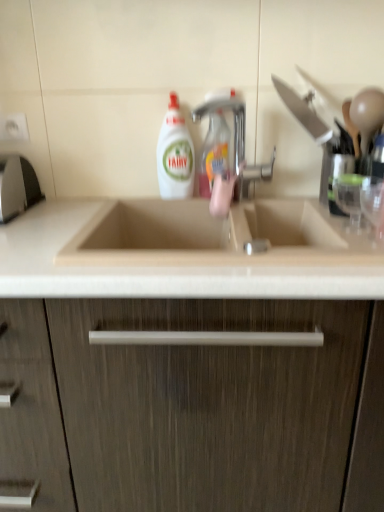
Question: Is translucent plastic spray bottle at center, which is counted as the second cleaning product, starting from the left, facing away from white glossy liquid at center, the 1th cleaning product positioned from the left?

Choices:
 (A) yes
 (B) no

Answer: (B)

Question: Can you confirm if translucent plastic spray bottle at center, which is counted as the second cleaning product, starting from the left, is taller than white glossy liquid at center, the second cleaning product in the right-to-left sequence?

Choices:
 (A) no
 (B) yes

Answer: (A)

Question: Is translucent plastic spray bottle at center, the first cleaning product positioned from the right, facing towards white glossy liquid at center, the second cleaning product in the right-to-left sequence?

Choices:
 (A) yes
 (B) no

Answer: (B)

Question: Is translucent plastic spray bottle at center, the first cleaning product positioned from the right, smaller than white glossy liquid at center, the 1th cleaning product positioned from the left?

Choices:
 (A) no
 (B) yes

Answer: (B)

Question: Can you confirm if translucent plastic spray bottle at center, the first cleaning product positioned from the right, is bigger than white glossy liquid at center, the second cleaning product in the right-to-left sequence?

Choices:
 (A) yes
 (B) no

Answer: (B)

Question: Is beige marble countertop at center bigger or smaller than white glossy liquid at center, the second cleaning product in the right-to-left sequence?

Choices:
 (A) small
 (B) big

Answer: (B)

Question: Would you say beige marble countertop at center is inside or outside white glossy liquid at center, the 1th cleaning product positioned from the left?

Choices:
 (A) outside
 (B) inside

Answer: (A)

Question: Visually, is beige marble countertop at center positioned to the left or to the right of white glossy liquid at center, the second cleaning product in the right-to-left sequence?

Choices:
 (A) right
 (B) left

Answer: (A)

Question: Considering the positions of point (296, 231) and point (180, 126), is point (296, 231) closer or farther from the camera than point (180, 126)?

Choices:
 (A) closer
 (B) farther

Answer: (B)

Question: Would you say translucent plastic spray bottle at center, the first cleaning product positioned from the right, is inside or outside white glossy liquid at center, the second cleaning product in the right-to-left sequence?

Choices:
 (A) outside
 (B) inside

Answer: (A)

Question: Considering their positions, is translucent plastic spray bottle at center, the first cleaning product positioned from the right, located in front of or behind white glossy liquid at center, the second cleaning product in the right-to-left sequence?

Choices:
 (A) behind
 (B) front

Answer: (B)

Question: From a real-world perspective, relative to white glossy liquid at center, the second cleaning product in the right-to-left sequence, is translucent plastic spray bottle at center, the first cleaning product positioned from the right, vertically above or below?

Choices:
 (A) above
 (B) below

Answer: (A)

Question: Considering the relative positions of translucent plastic spray bottle at center, which is counted as the second cleaning product, starting from the left, and white glossy liquid at center, the second cleaning product in the right-to-left sequence, in the image provided, is translucent plastic spray bottle at center, which is counted as the second cleaning product, starting from the left, to the left or to the right of white glossy liquid at center, the second cleaning product in the right-to-left sequence,?

Choices:
 (A) left
 (B) right

Answer: (B)

Question: From the image's perspective, is white glossy liquid at center, the 1th cleaning product positioned from the left, positioned above or below beige wood cabinet at center?

Choices:
 (A) above
 (B) below

Answer: (A)

Question: Do you think white glossy liquid at center, the 1th cleaning product positioned from the left, is within beige wood cabinet at center, or outside of it?

Choices:
 (A) outside
 (B) inside

Answer: (A)